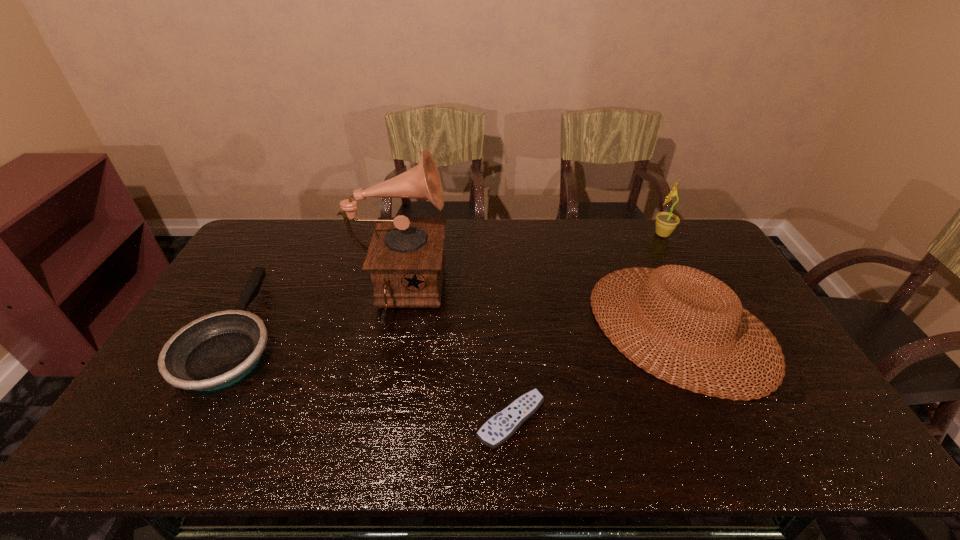
I want to click on free region located on the face of the fourth shortest object, so (x=597, y=234).

Where is `vacant space located on the face of the fourth shortest object`? This screenshot has width=960, height=540. vacant space located on the face of the fourth shortest object is located at coordinates (567, 234).

Locate an element on the screen. free space located 0.290m on the face of the fourth shortest object is located at coordinates (572, 234).

Identify the location of vacant space located 0.200m on the left of the third shortest object. (527, 326).

This screenshot has height=540, width=960. What are the coordinates of `free region located 0.150m on the handle side of the fourth tallest object` in the screenshot? It's located at (282, 251).

Image resolution: width=960 pixels, height=540 pixels. Identify the location of free region located 0.350m on the handle side of the fourth tallest object. (300, 220).

In order to click on vacant region located on the handle side of the fourth tallest object in this screenshot , I will do `click(290, 237)`.

Locate an element on the screen. The height and width of the screenshot is (540, 960). vacant space positioned 0.200m on the back of the shortest object is located at coordinates (506, 333).

Where is `object located at the far edge`? object located at the far edge is located at coordinates (666, 222).

I want to click on object that is at the near edge, so click(x=500, y=427).